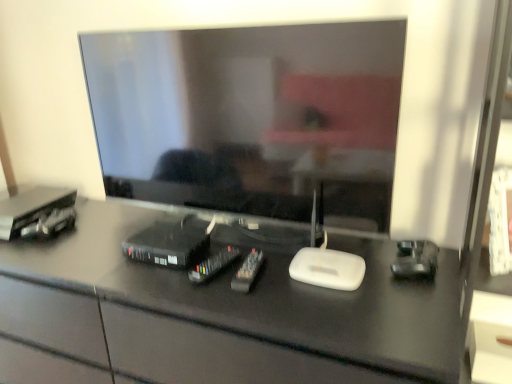
Find the location of a particular element. The image size is (512, 384). free space to the back side of black plastic remote control at center, the 3th equipment in the left-to-right sequence is located at coordinates (218, 248).